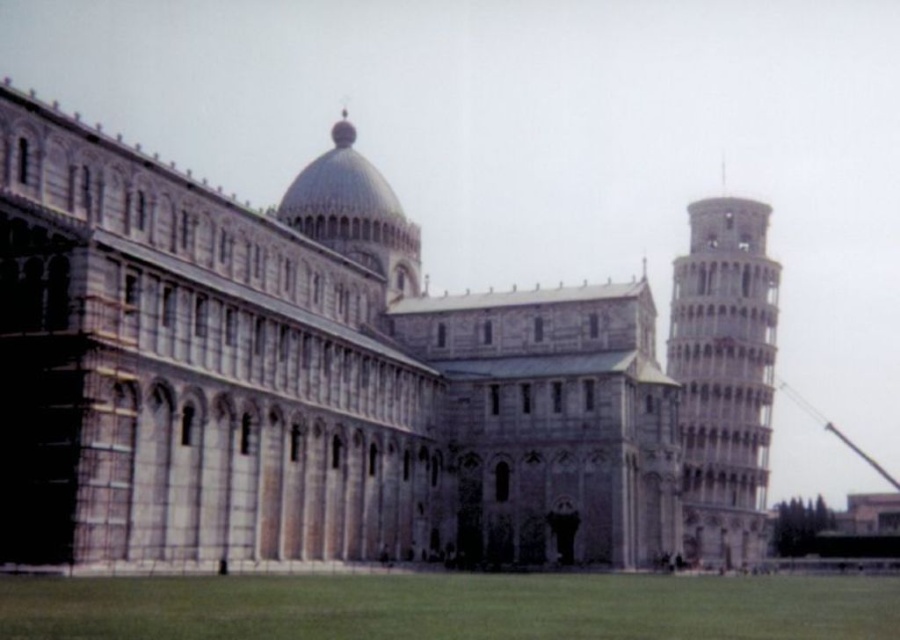
Question: Which point appears farthest from the camera in this image?

Choices:
 (A) [709, 332]
 (B) [752, 504]

Answer: (A)

Question: Can you confirm if stone cathedral at center is smaller than light gray stone tower at right?

Choices:
 (A) yes
 (B) no

Answer: (B)

Question: Does stone cathedral at center have a lesser width compared to light gray stone tower at right?

Choices:
 (A) yes
 (B) no

Answer: (B)

Question: Is stone cathedral at center smaller than light gray stone tower at right?

Choices:
 (A) yes
 (B) no

Answer: (B)

Question: Which of the following is the farthest from the observer?

Choices:
 (A) stone cathedral at center
 (B) light gray stone tower at right

Answer: (B)